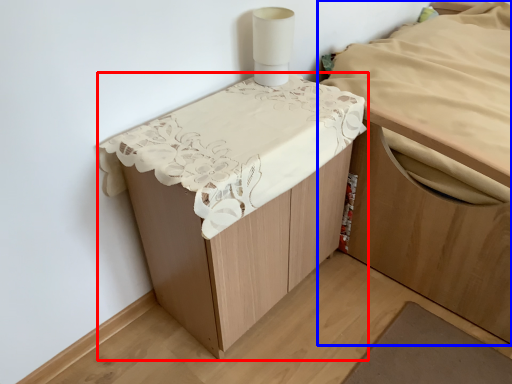
Question: Which of the following is the closest to the observer, furniture (highlighted by a red box) or furniture (highlighted by a blue box)?

Choices:
 (A) furniture
 (B) furniture

Answer: (A)